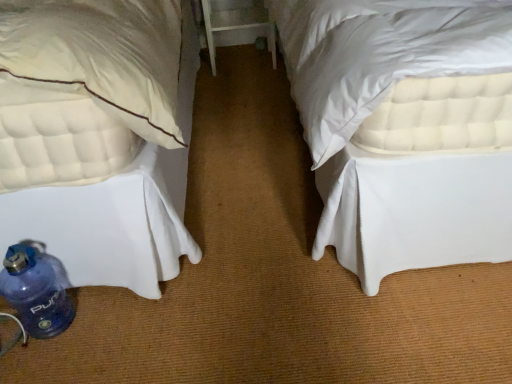
Question: Could you tell me if white wood table at center is turned towards blue plastic water bottle at lower left?

Choices:
 (A) no
 (B) yes

Answer: (B)

Question: Does white wood table at center have a lesser height compared to blue plastic water bottle at lower left?

Choices:
 (A) no
 (B) yes

Answer: (A)

Question: Does white wood table at center lie in front of blue plastic water bottle at lower left?

Choices:
 (A) no
 (B) yes

Answer: (A)

Question: Is white wood table at center not within blue plastic water bottle at lower left?

Choices:
 (A) yes
 (B) no

Answer: (A)

Question: Considering the relative positions of white wood table at center and blue plastic water bottle at lower left in the image provided, is white wood table at center to the left of blue plastic water bottle at lower left from the viewer's perspective?

Choices:
 (A) yes
 (B) no

Answer: (B)

Question: From the image's perspective, is white wood table at center below blue plastic water bottle at lower left?

Choices:
 (A) yes
 (B) no

Answer: (B)

Question: Does blue plastic water bottle at lower left touch white quilted mattress at lower left?

Choices:
 (A) yes
 (B) no

Answer: (B)

Question: Is blue plastic water bottle at lower left smaller than white quilted mattress at lower left?

Choices:
 (A) yes
 (B) no

Answer: (A)

Question: Is blue plastic water bottle at lower left facing towards white quilted mattress at lower left?

Choices:
 (A) yes
 (B) no

Answer: (B)

Question: Is blue plastic water bottle at lower left wider than white quilted mattress at lower left?

Choices:
 (A) no
 (B) yes

Answer: (A)

Question: From the image's perspective, is blue plastic water bottle at lower left under white quilted mattress at lower left?

Choices:
 (A) no
 (B) yes

Answer: (B)

Question: Is blue plastic water bottle at lower left located outside white quilted mattress at lower left?

Choices:
 (A) yes
 (B) no

Answer: (B)

Question: Is white quilted mattress at lower left bigger than blue plastic water bottle at lower left?

Choices:
 (A) no
 (B) yes

Answer: (B)